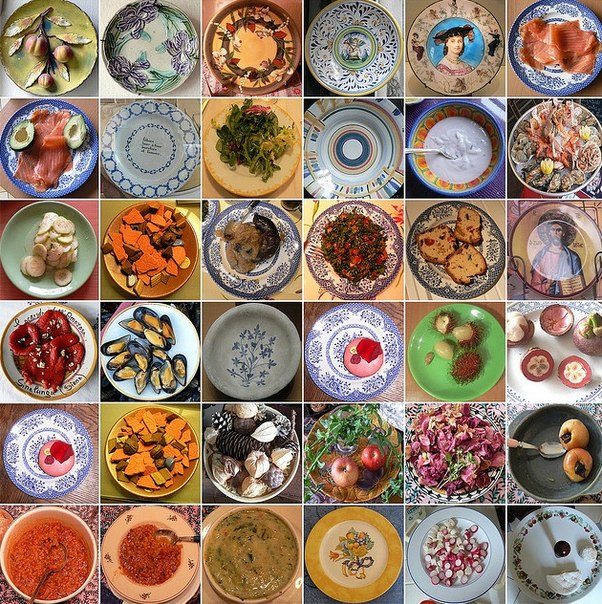
The width and height of the screenshot is (602, 604). In order to click on empty plates in this screenshot , I will do `click(157, 47)`, `click(247, 48)`, `click(350, 48)`, `click(461, 53)`, `click(350, 152)`, `click(147, 151)`, `click(554, 251)`, `click(250, 359)`, `click(353, 557)`.